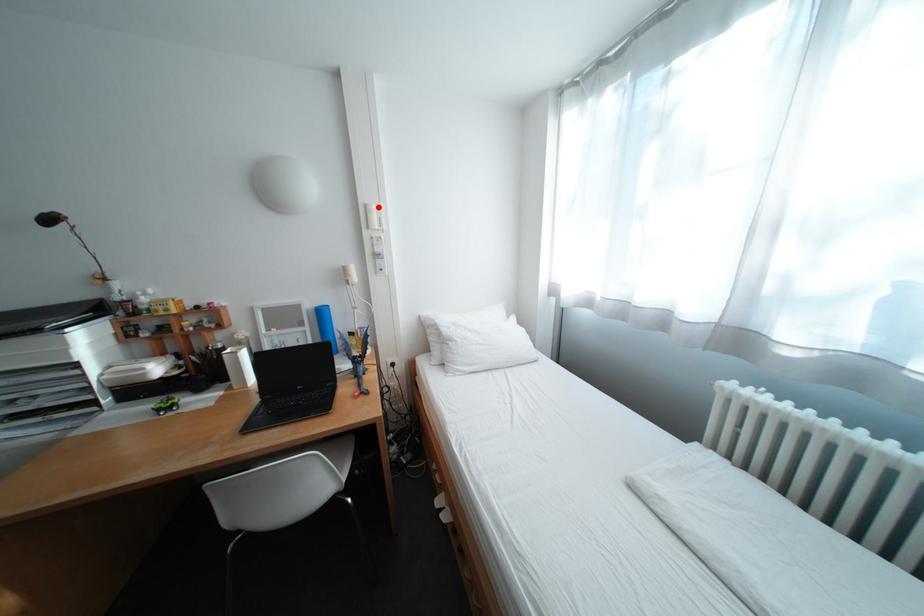
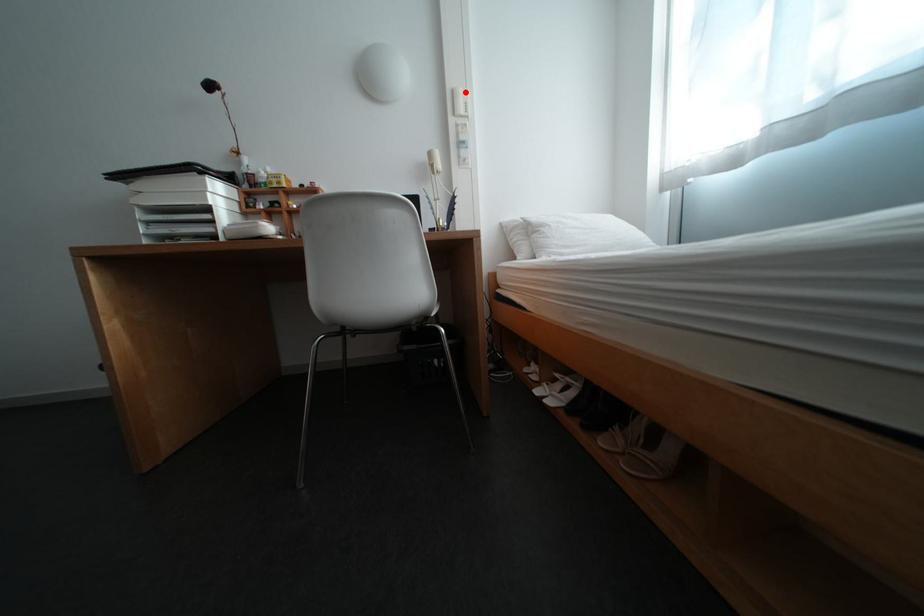
I am providing you with two images of the same scene from different viewpoints. A red point is marked on the first image and another point is marked on the second image. Is the marked point in image1 the same physical position as the marked point in image2?

Yes